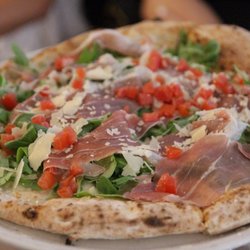
Locate an element on the screen. The height and width of the screenshot is (250, 250). plate is located at coordinates (91, 244), (126, 244), (196, 241).